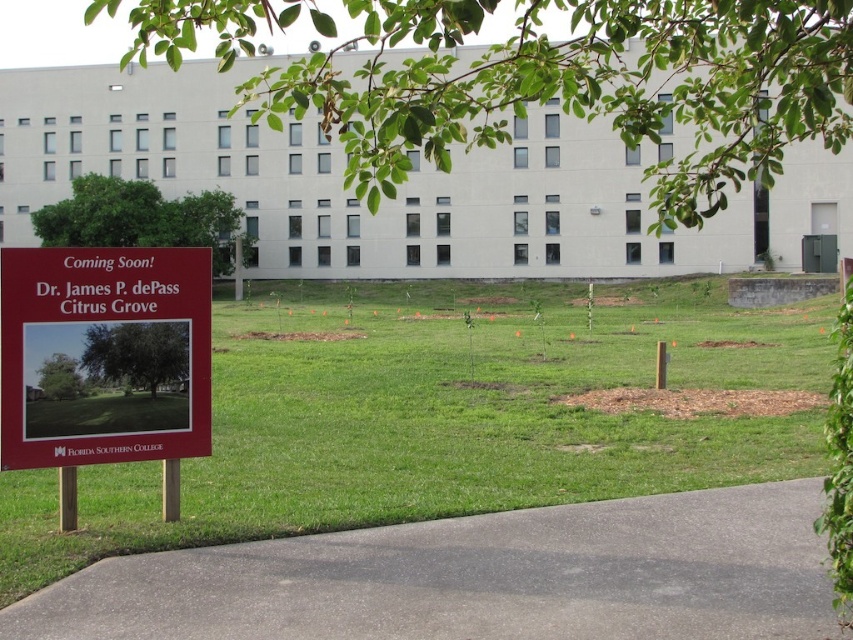
You are a visitor arriving at the Florida Southern College campus. You see a gray asphalt path at lower center and a red matte sign at lower left. Which object takes up more space in the image?

The red matte sign at lower left occupies more space in the image than the gray asphalt path at lower center, as the gray asphalt path at lower center occupies less space than red matte sign at lower left.

You are a visitor arriving at the Florida Southern College campus and see the gray asphalt path at lower center and the red matte sign at lower left. Which object is closer to the entrance of the building?

The gray asphalt path at lower center is closer to the entrance of the building because it is positioned below the red matte sign at lower left, indicating it is further away from the viewer and closer to the building entrance.